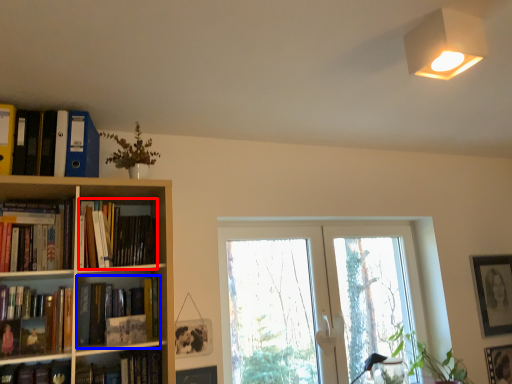
Question: Among these objects, which one is farthest to the camera, book (highlighted by a red box) or book (highlighted by a blue box)?

Choices:
 (A) book
 (B) book

Answer: (B)